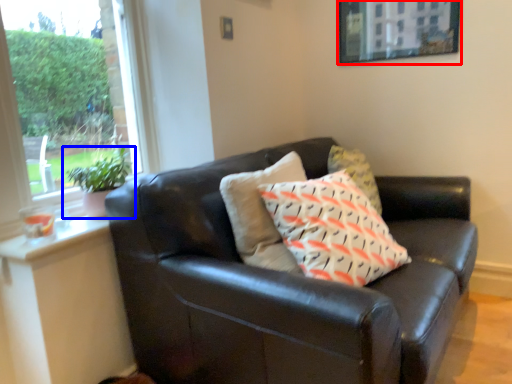
Question: Which point is closer to the camera, picture frame (highlighted by a red box) or houseplant (highlighted by a blue box)?

Choices:
 (A) picture frame
 (B) houseplant

Answer: (B)